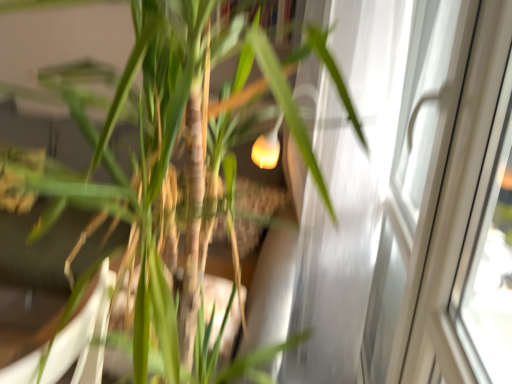
Question: Can you confirm if white glossy screen door at right is smaller than green matte bamboo at center?

Choices:
 (A) no
 (B) yes

Answer: (B)

Question: Is white glossy screen door at right closer to the viewer compared to green matte bamboo at center?

Choices:
 (A) no
 (B) yes

Answer: (A)

Question: Considering the relative sizes of white glossy screen door at right and green matte bamboo at center in the image provided, is white glossy screen door at right bigger than green matte bamboo at center?

Choices:
 (A) no
 (B) yes

Answer: (A)

Question: Considering the relative sizes of white glossy screen door at right and green matte bamboo at center in the image provided, is white glossy screen door at right wider than green matte bamboo at center?

Choices:
 (A) yes
 (B) no

Answer: (B)

Question: Is white glossy screen door at right aimed at green matte bamboo at center?

Choices:
 (A) yes
 (B) no

Answer: (B)

Question: From a real-world perspective, does white glossy screen door at right stand above green matte bamboo at center?

Choices:
 (A) no
 (B) yes

Answer: (A)

Question: Is the position of green matte bamboo at center more distant than that of white glossy screen door at right?

Choices:
 (A) yes
 (B) no

Answer: (B)

Question: Can you confirm if green matte bamboo at center is positioned to the left of white glossy screen door at right?

Choices:
 (A) no
 (B) yes

Answer: (B)

Question: Is green matte bamboo at center not inside white glossy screen door at right?

Choices:
 (A) no
 (B) yes

Answer: (B)

Question: Can you confirm if green matte bamboo at center is shorter than white glossy screen door at right?

Choices:
 (A) yes
 (B) no

Answer: (A)

Question: Is green matte bamboo at center positioned with its back to white glossy screen door at right?

Choices:
 (A) no
 (B) yes

Answer: (A)

Question: Considering the relative sizes of green matte bamboo at center and white glossy screen door at right in the image provided, is green matte bamboo at center taller than white glossy screen door at right?

Choices:
 (A) yes
 (B) no

Answer: (B)

Question: Considering the relative positions of white glossy screen door at right and green matte bamboo at center in the image provided, is white glossy screen door at right to the left or to the right of green matte bamboo at center?

Choices:
 (A) right
 (B) left

Answer: (A)